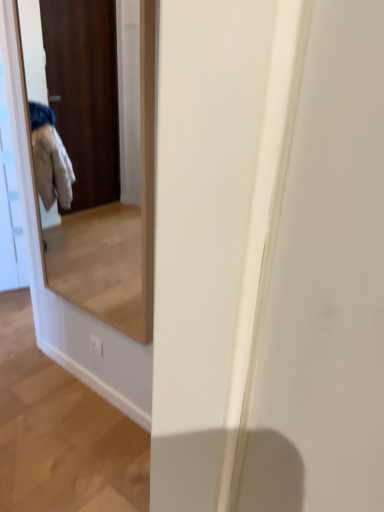
At what (x,y) coordinates should I click in order to perform the action: click on matte wooden mirror at upper left. Please return your answer as a coordinate pair (x, y). The height and width of the screenshot is (512, 384). Looking at the image, I should click on (99, 158).

What do you see at coordinates (99, 158) in the screenshot?
I see `matte wooden mirror at upper left` at bounding box center [99, 158].

Measure the distance between point (x=140, y=294) and camera.

Point (x=140, y=294) is 9.37 feet from camera.

Locate an element on the screen. The height and width of the screenshot is (512, 384). matte wooden mirror at upper left is located at coordinates (99, 158).